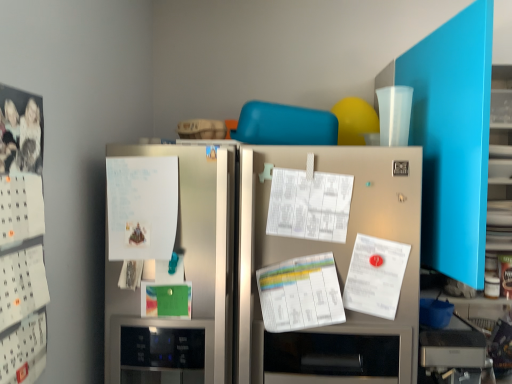
Question: From the image's perspective, does satin silver refrigerator at center appear lower than white paper calendar at left?

Choices:
 (A) no
 (B) yes

Answer: (B)

Question: Is the position of satin silver refrigerator at center more distant than that of white paper calendar at left?

Choices:
 (A) yes
 (B) no

Answer: (A)

Question: Is satin silver refrigerator at center with white paper calendar at left?

Choices:
 (A) no
 (B) yes

Answer: (A)

Question: From a real-world perspective, is satin silver refrigerator at center beneath white paper calendar at left?

Choices:
 (A) no
 (B) yes

Answer: (B)

Question: From a real-world perspective, is satin silver refrigerator at center on white paper calendar at left?

Choices:
 (A) yes
 (B) no

Answer: (B)

Question: Can you confirm if satin silver refrigerator at center is wider than white paper calendar at left?

Choices:
 (A) yes
 (B) no

Answer: (A)

Question: Can you confirm if satin silver refrigerator at center is smaller than white paper at left?

Choices:
 (A) yes
 (B) no

Answer: (B)

Question: From the image's perspective, is satin silver refrigerator at center beneath white paper at left?

Choices:
 (A) yes
 (B) no

Answer: (A)

Question: From a real-world perspective, does satin silver refrigerator at center sit lower than white paper at left?

Choices:
 (A) yes
 (B) no

Answer: (A)

Question: Does satin silver refrigerator at center have a greater width compared to white paper at left?

Choices:
 (A) no
 (B) yes

Answer: (B)

Question: Is satin silver refrigerator at center at the left side of white paper at left?

Choices:
 (A) yes
 (B) no

Answer: (B)

Question: Is white paper at left at the back of satin silver refrigerator at center?

Choices:
 (A) yes
 (B) no

Answer: (B)

Question: Does white paper at left have a lesser width compared to white paper calendar at left?

Choices:
 (A) yes
 (B) no

Answer: (B)